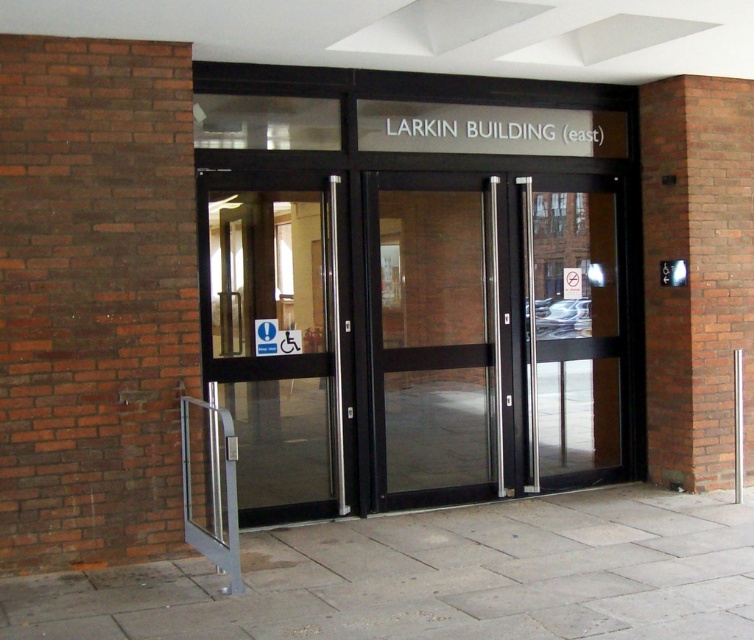
Question: From the image, what is the correct spatial relationship of transparent glass elevator at center in relation to transparent glass door at left?

Choices:
 (A) right
 (B) left

Answer: (A)

Question: Which object is closer to the camera taking this photo?

Choices:
 (A) transparent glass door at left
 (B) transparent glass door at right

Answer: (A)

Question: Which object is the closest to the transparent glass door at center?

Choices:
 (A) transparent glass door at right
 (B) transparent glass door at left

Answer: (A)

Question: Is transparent glass elevator at center to the right of transparent glass door at left from the viewer's perspective?

Choices:
 (A) yes
 (B) no

Answer: (A)

Question: Which of the following is the closest to the observer?

Choices:
 (A) (575, 397)
 (B) (238, 308)
 (C) (320, 458)

Answer: (B)

Question: Can you confirm if transparent glass door at left is thinner than transparent glass door at right?

Choices:
 (A) yes
 (B) no

Answer: (B)